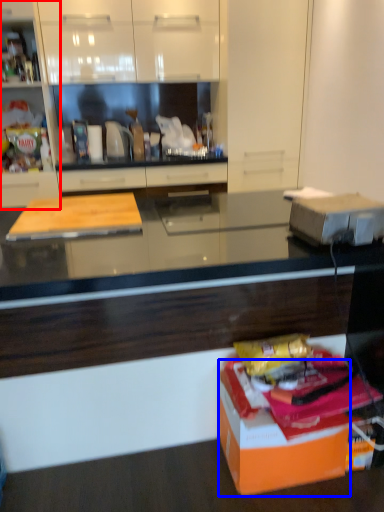
Question: Among these objects, which one is nearest to the camera, cabinetry (highlighted by a red box) or cardboard box (highlighted by a blue box)?

Choices:
 (A) cabinetry
 (B) cardboard box

Answer: (B)